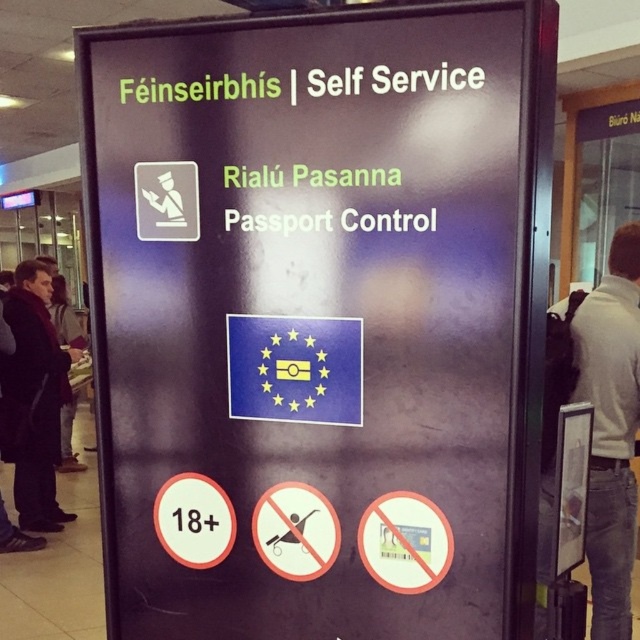
Question: Does white shirt at center appear on the left side of white plastic circle at lower left?

Choices:
 (A) yes
 (B) no

Answer: (B)

Question: Which point is farther from the camera taking this photo?

Choices:
 (A) (193, 541)
 (B) (58, 380)
 (C) (630, 484)

Answer: (B)

Question: Does dark wool coat at left have a larger size compared to white plastic circle at lower left?

Choices:
 (A) yes
 (B) no

Answer: (A)

Question: Can you confirm if matte black sign at center is positioned to the left of white shirt at center?

Choices:
 (A) no
 (B) yes

Answer: (B)

Question: Which object is farther from the camera taking this photo?

Choices:
 (A) white plastic circle at lower left
 (B) dark wool coat at left
 (C) white shirt at center
 (D) matte black sign at center

Answer: (B)

Question: Which of these objects is positioned closest to the white plastic circle at lower left?

Choices:
 (A) white shirt at center
 (B) dark wool coat at left

Answer: (A)